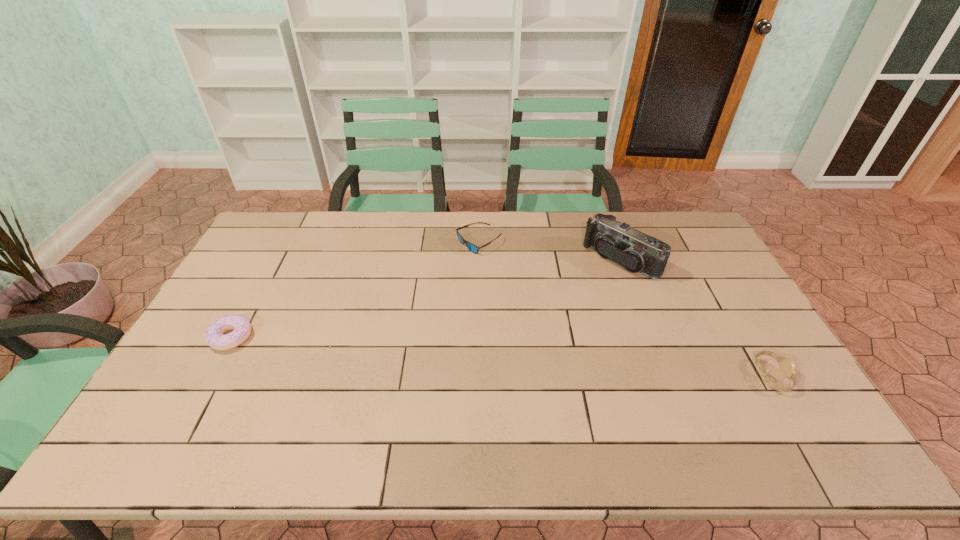
In the image, there is a desktop. Where is `free space at the far edge`? free space at the far edge is located at coordinates (346, 213).

The height and width of the screenshot is (540, 960). Find the location of `free point at the near edge`. free point at the near edge is located at coordinates 343,413.

You are a GUI agent. You are given a task and a screenshot of the screen. Output one action in this format:
    pyautogui.click(x=<x>, y=<y>)
    Task: Click on the vacant space at the right edge
    The image size is (960, 540).
    Given the screenshot: What is the action you would take?
    pyautogui.click(x=726, y=322)

In the image, there is a desktop. At what (x,y) coordinates should I click in order to perform the action: click on vacant space at the far left corner. Please return your answer as a coordinate pair (x, y). The width and height of the screenshot is (960, 540). Looking at the image, I should click on (293, 218).

The width and height of the screenshot is (960, 540). I want to click on free space at the near left corner of the desktop, so click(x=170, y=388).

Find the location of a particular element. The width and height of the screenshot is (960, 540). free space between the camcorder and the doughnut is located at coordinates (426, 299).

I want to click on free space between the rightmost object and the sunglasses, so click(626, 309).

The image size is (960, 540). Find the location of `free space between the doughnut and the watch`. free space between the doughnut and the watch is located at coordinates (502, 356).

Locate an element on the screen. empty location between the second object from left to right and the watch is located at coordinates (626, 309).

Locate an element on the screen. The image size is (960, 540). vacant point located between the tallest object and the doughnut is located at coordinates (426, 299).